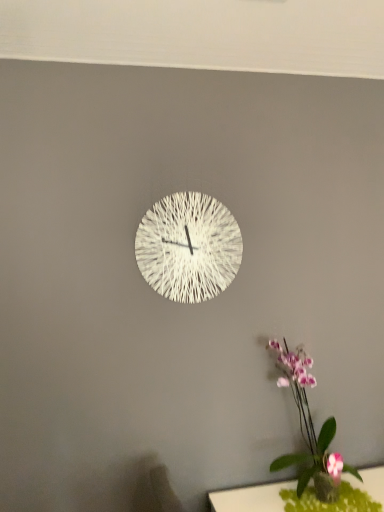
Question: Considering the relative sizes of purple-pink orchid at lower right and white woven clock at center in the image provided, is purple-pink orchid at lower right bigger than white woven clock at center?

Choices:
 (A) no
 (B) yes

Answer: (B)

Question: Considering the relative positions of purple-pink orchid at lower right and white woven clock at center in the image provided, is purple-pink orchid at lower right to the right of white woven clock at center from the viewer's perspective?

Choices:
 (A) yes
 (B) no

Answer: (A)

Question: Is purple-pink orchid at lower right not within white woven clock at center?

Choices:
 (A) no
 (B) yes

Answer: (B)

Question: Could you tell me if purple-pink orchid at lower right is turned towards white woven clock at center?

Choices:
 (A) no
 (B) yes

Answer: (A)

Question: From a real-world perspective, is purple-pink orchid at lower right positioned over white woven clock at center based on gravity?

Choices:
 (A) no
 (B) yes

Answer: (A)

Question: Would you say white woven clock at center is part of purple-pink orchid at lower right's contents?

Choices:
 (A) yes
 (B) no

Answer: (B)

Question: Considering the relative sizes of white woven clock at center and green felt table at lower right in the image provided, is white woven clock at center taller than green felt table at lower right?

Choices:
 (A) yes
 (B) no

Answer: (A)

Question: Are white woven clock at center and green felt table at lower right far apart?

Choices:
 (A) yes
 (B) no

Answer: (B)

Question: Is the depth of white woven clock at center less than that of green felt table at lower right?

Choices:
 (A) yes
 (B) no

Answer: (B)

Question: Is white woven clock at center facing towards green felt table at lower right?

Choices:
 (A) no
 (B) yes

Answer: (A)

Question: Considering the relative positions of white woven clock at center and green felt table at lower right in the image provided, is white woven clock at center to the right of green felt table at lower right from the viewer's perspective?

Choices:
 (A) yes
 (B) no

Answer: (B)

Question: From the image's perspective, is white woven clock at center located above green felt table at lower right?

Choices:
 (A) no
 (B) yes

Answer: (B)

Question: Can you confirm if green felt table at lower right is smaller than white woven clock at center?

Choices:
 (A) no
 (B) yes

Answer: (B)